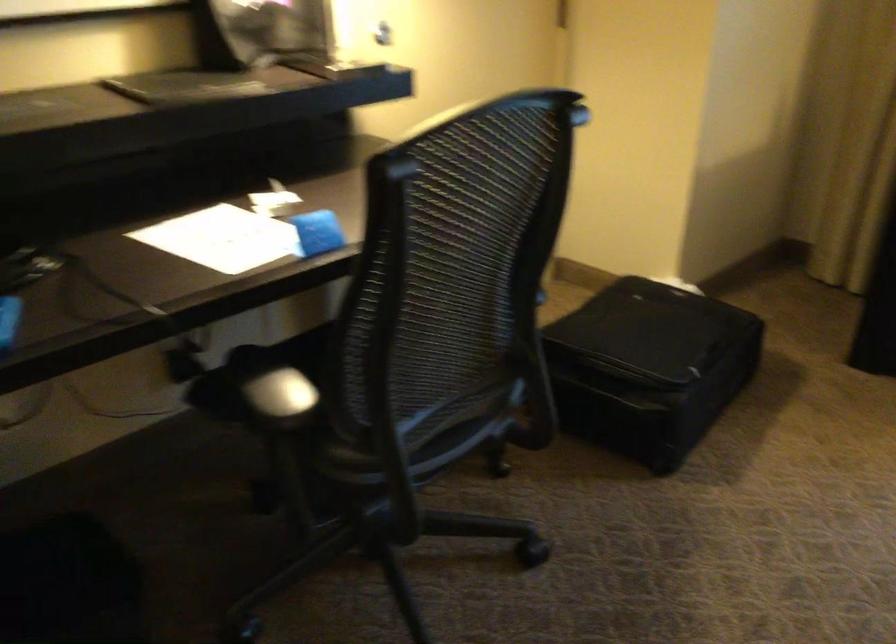
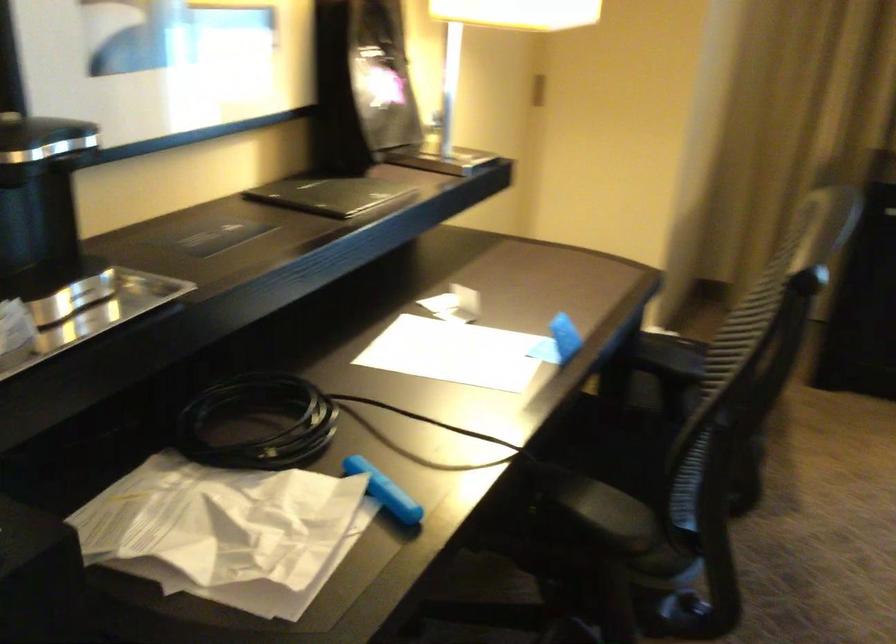
Question: The camera is either moving clockwise (left) or counter-clockwise (right) around the object. The first image is from the beginning of the video and the second image is from the end. Is the camera moving left or right when shooting the video?

Choices:
 (A) Left
 (B) Right

Answer: (A)